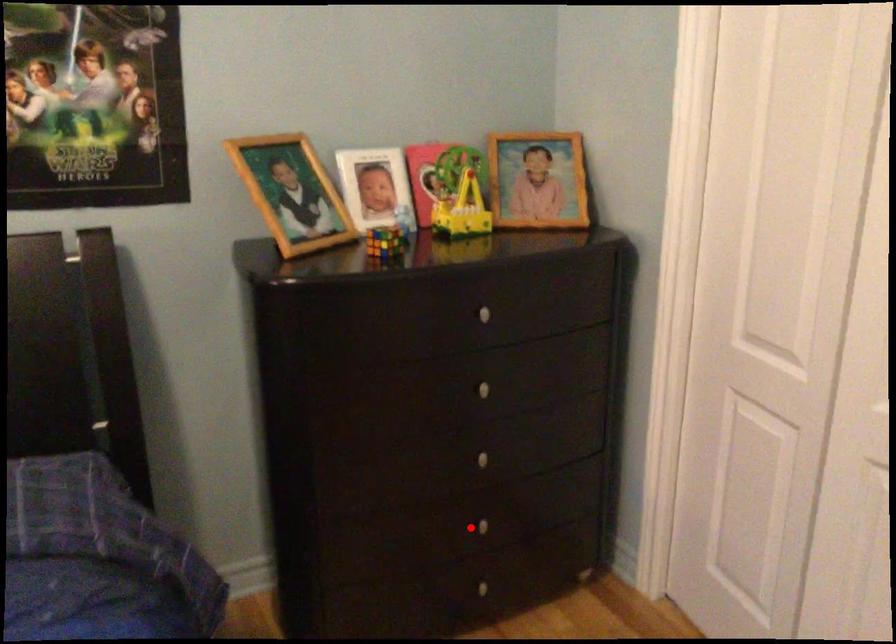
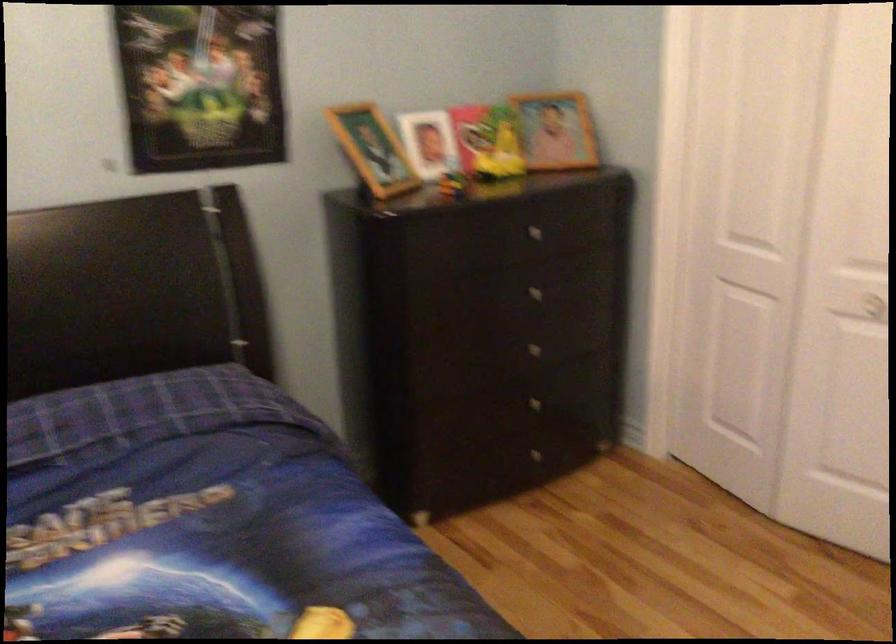
Locate, in the second image, the point that corresponds to the highlighted location in the first image.

(528, 406)